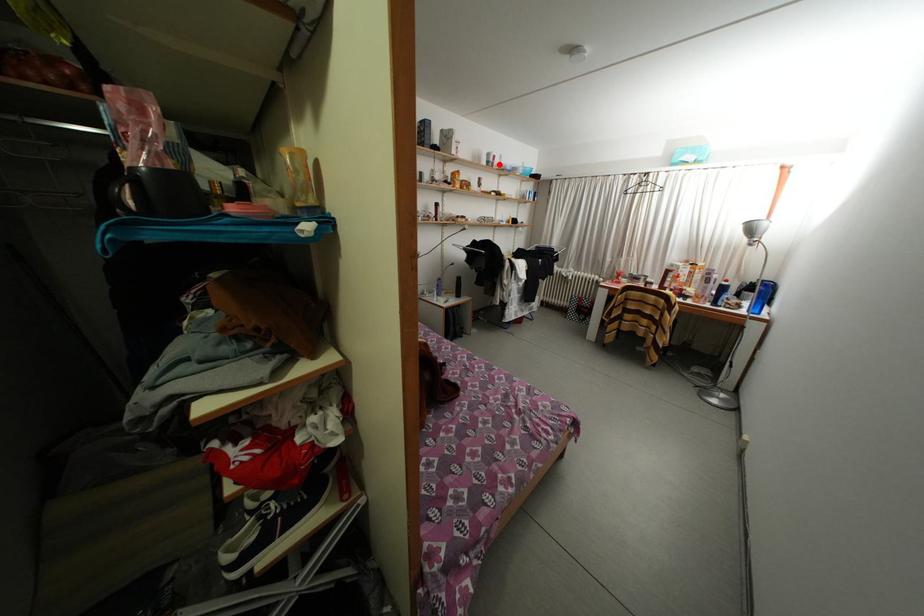
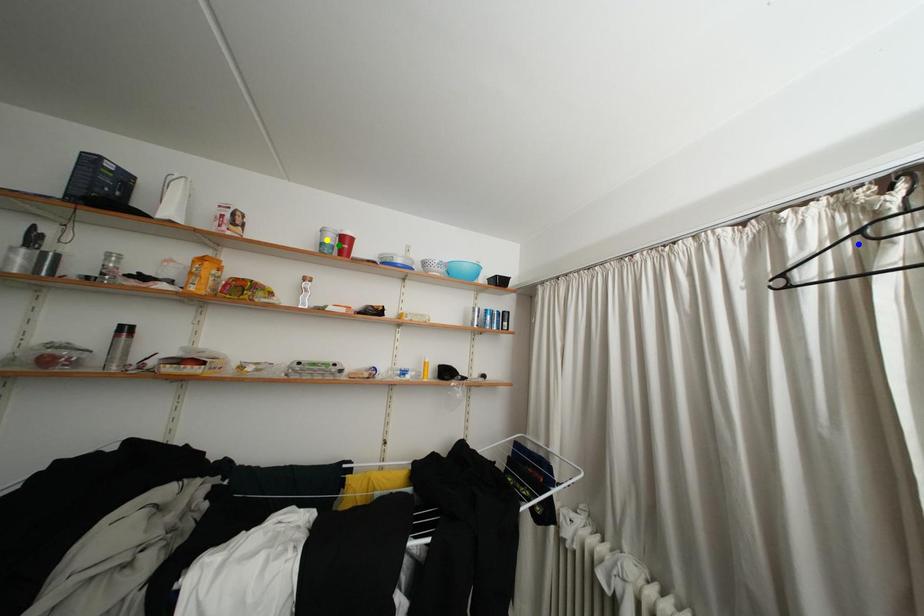
Question: I am providing you with two images of the same scene from different viewpoints. A red point is marked on the first image. You are given multiple points on the second image. Which mark in image 2 goes with the point in image 1?

Choices:
 (A) blue point
 (B) yellow point
 (C) green point

Answer: (C)